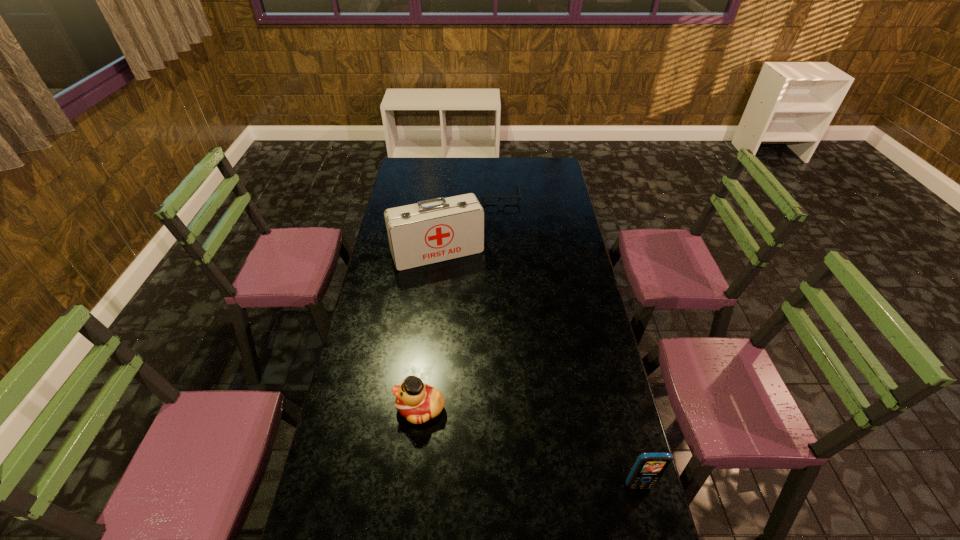
Find the location of a particular element. This screenshot has height=540, width=960. the third tallest object is located at coordinates (418, 402).

The width and height of the screenshot is (960, 540). Find the location of `duck`. duck is located at coordinates (418, 402).

You are a GUI agent. You are given a task and a screenshot of the screen. Output one action in this format:
    pyautogui.click(x=<x>, y=<y>)
    Task: Click on the rightmost object
    The image size is (960, 540).
    Given the screenshot: What is the action you would take?
    pyautogui.click(x=649, y=467)

The height and width of the screenshot is (540, 960). I want to click on cellular telephone, so click(649, 467).

Identify the location of the third nearest object. This screenshot has height=540, width=960. pyautogui.click(x=430, y=231).

Find the location of `the tallest object`. the tallest object is located at coordinates (430, 231).

Locate an element on the screen. This screenshot has width=960, height=540. spectacles is located at coordinates (483, 197).

Where is `the farthest object`? the farthest object is located at coordinates (483, 197).

Locate an element on the screen. This screenshot has height=540, width=960. free location located on the face of the second nearest object is located at coordinates (355, 408).

Find the location of a particular element. The image size is (960, 540). vacant space located 0.070m on the face of the second nearest object is located at coordinates (374, 408).